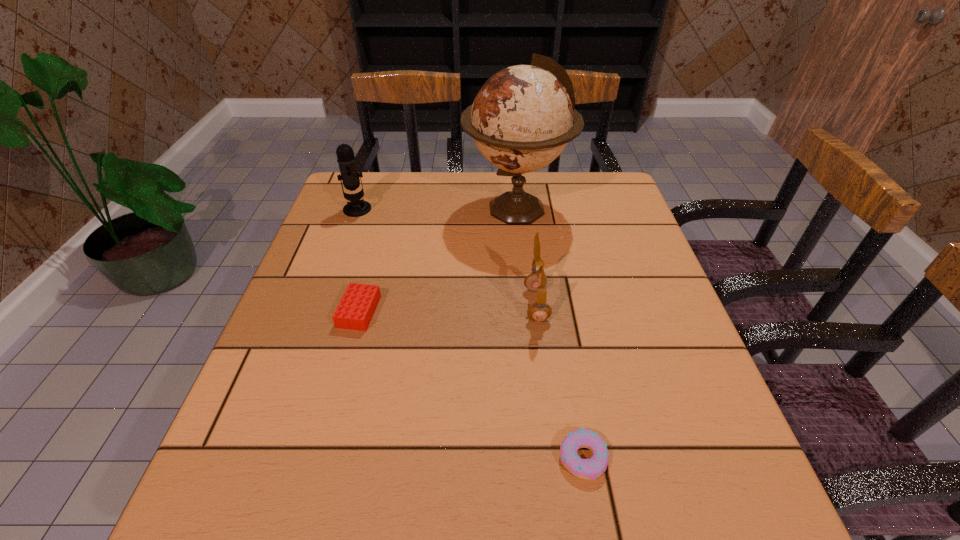
Find the location of a particular element. The image size is (960, 540). empty space between the earphone and the fourth object from right to left is located at coordinates (447, 308).

Locate an element on the screen. vacant area that lies between the fourth tallest object and the doughnut is located at coordinates (471, 384).

The height and width of the screenshot is (540, 960). I want to click on free area in between the fourth tallest object and the shortest object, so click(x=471, y=384).

Where is `free space between the third shortest object and the globe`? free space between the third shortest object and the globe is located at coordinates (526, 256).

Identify the location of free space between the shortest object and the Lego. (471, 384).

I want to click on vacant space in between the doughnut and the second tallest object, so click(x=470, y=334).

What are the coordinates of `blank region between the leftmost object and the Lego` in the screenshot? It's located at (358, 261).

This screenshot has height=540, width=960. What are the coordinates of `vacant area that lies between the third shortest object and the leftmost object` in the screenshot? It's located at (446, 257).

Select which object appears as the closest to the globe. Please provide its 2D coordinates. Your answer should be formatted as a tuple, i.e. [(x, y)], where the tuple contains the x and y coordinates of a point satisfying the conditions above.

[(536, 281)]

Select which object is the fourth closest to the tallest object. Please provide its 2D coordinates. Your answer should be formatted as a tuple, i.e. [(x, y)], where the tuple contains the x and y coordinates of a point satisfying the conditions above.

[(590, 469)]